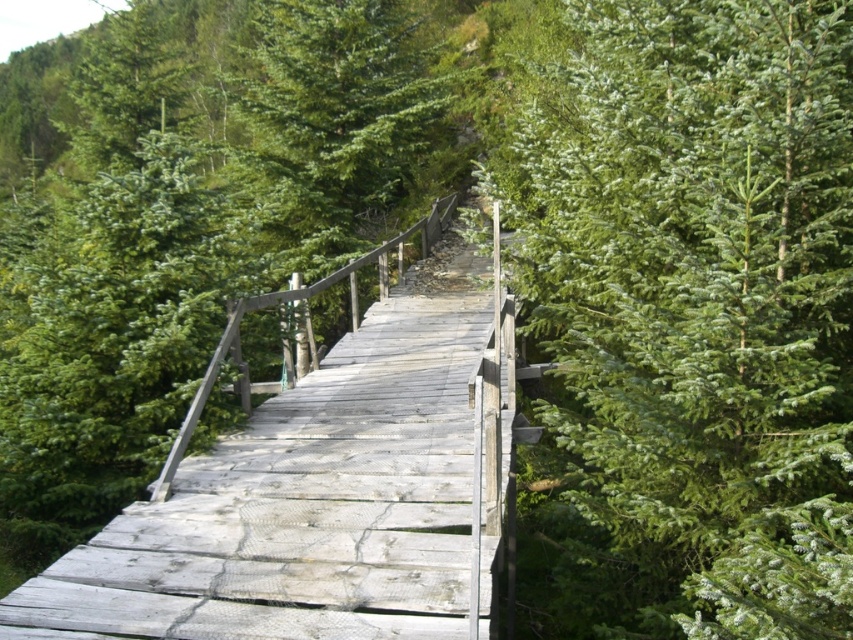
Can you confirm if green matte tree at upper right is positioned below weathered wood bridge at center?

Actually, green matte tree at upper right is above weathered wood bridge at center.

Does green matte tree at upper right have a lesser height compared to weathered wood bridge at center?

Yes.

Where is `green matte tree at upper right`? This screenshot has height=640, width=853. green matte tree at upper right is located at coordinates (699, 308).